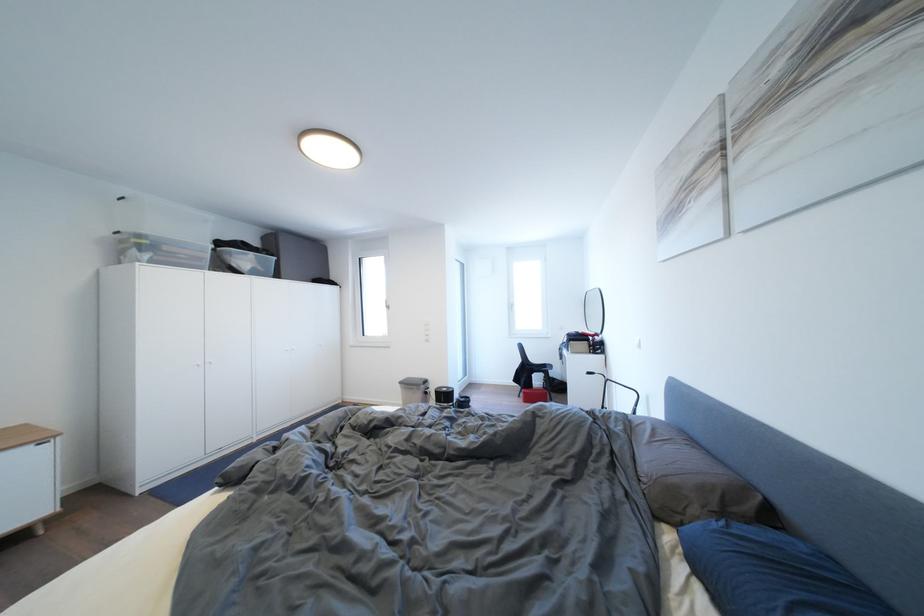
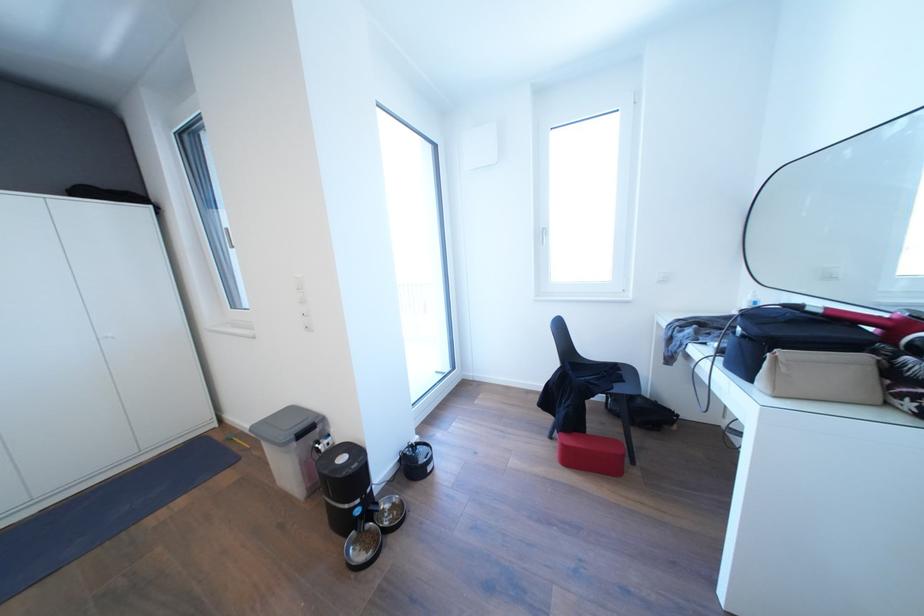
Question: The images are taken continuously from a first-person perspective. In which direction are you moving?

Choices:
 (A) Left
 (B) Right
 (C) Forward
 (D) Backward

Answer: (C)